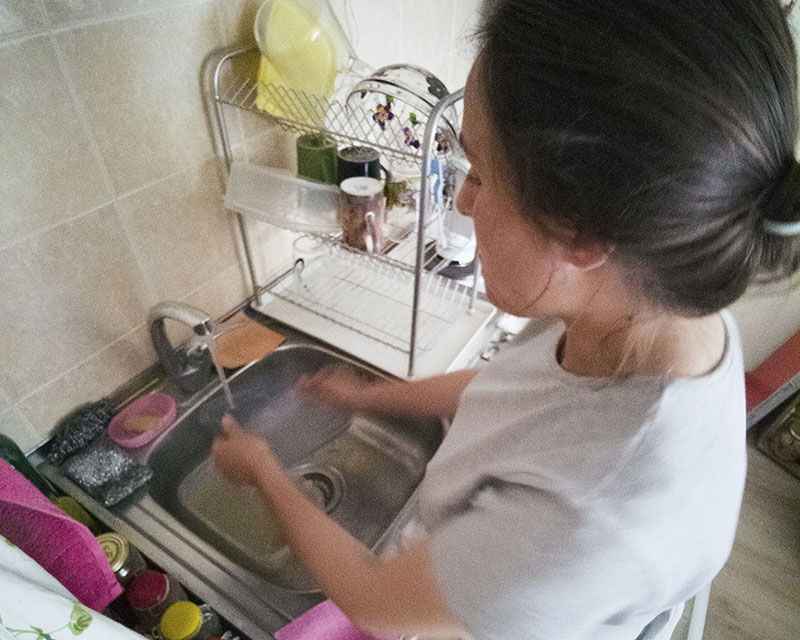
You are a GUI agent. You are given a task and a screenshot of the screen. Output one action in this format:
    pyautogui.click(x=<x>, y=<y>)
    Task: Click on the pink towel
    Image resolution: width=800 pixels, height=640 pixels.
    Given the screenshot: What is the action you would take?
    pyautogui.click(x=42, y=541)